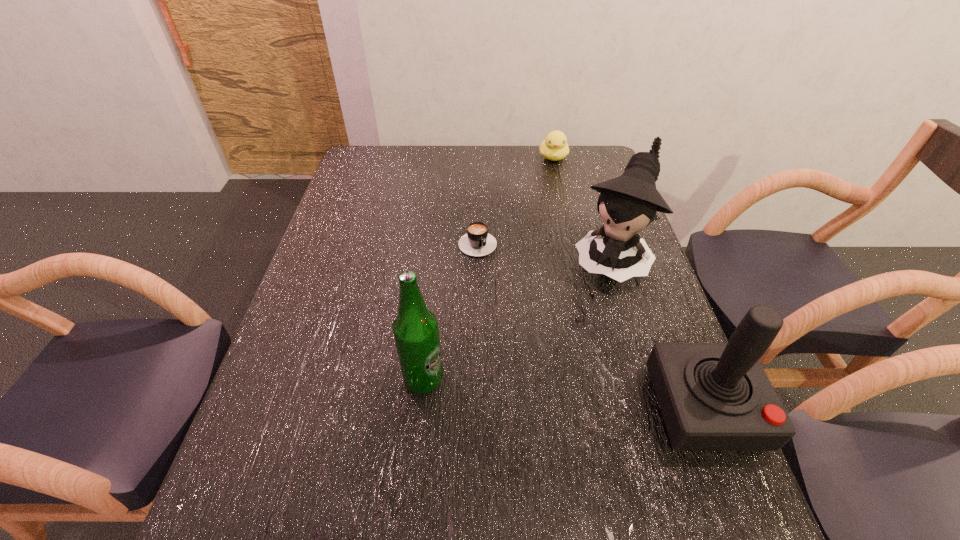
Locate an element on the screen. The height and width of the screenshot is (540, 960). vacant spot on the desktop that is between the beer bottle and the joystick and is positioned at the beak of the farthest object is located at coordinates (601, 397).

The width and height of the screenshot is (960, 540). Identify the location of vacant space on the desktop that is between the beer bottle and the joystick and is positioned with the handle on the side of the cappuccino. (574, 394).

This screenshot has height=540, width=960. What are the coordinates of `vacant space on the desktop that is between the leftmost object and the joystick and is positioned at the face of the doll` in the screenshot? It's located at (534, 390).